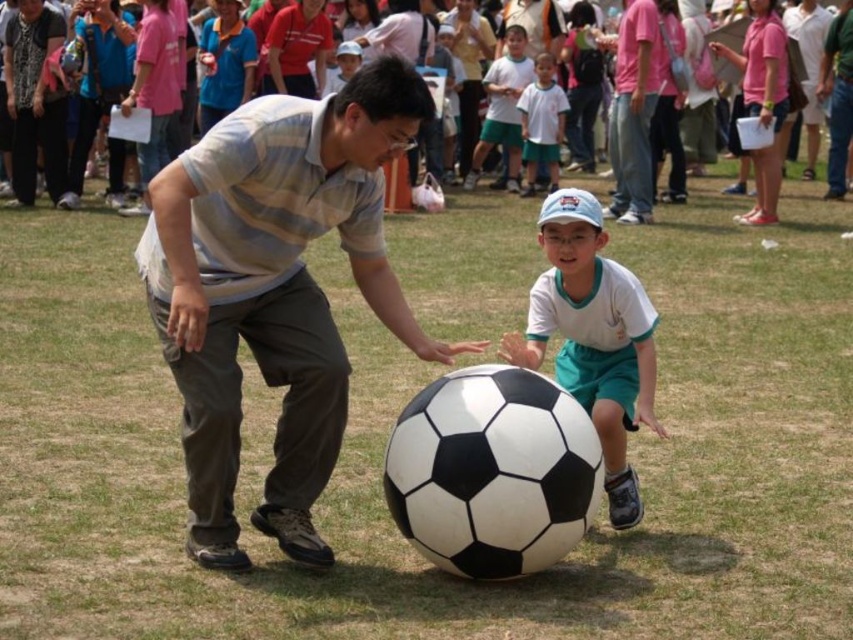
Can you confirm if white cotton shirt at upper center is taller than pink cotton crowd at upper center?

No.

Locate an element on the screen. The height and width of the screenshot is (640, 853). white cotton shirt at upper center is located at coordinates (503, 108).

Who is positioned more to the left, white matte soccer ball at center or pink cotton crowd at upper center?

pink cotton crowd at upper center is more to the left.

Who is higher up, white matte soccer ball at center or pink cotton crowd at upper center?

pink cotton crowd at upper center

The image size is (853, 640). I want to click on white matte soccer ball at center, so click(x=592, y=337).

Which is more to the right, striped cotton shirt at center or white cotton shirt at upper center?

white cotton shirt at upper center is more to the right.

At what (x,y) coordinates should I click in order to perform the action: click on striped cotton shirt at center. Please return your answer as a coordinate pair (x, y). The height and width of the screenshot is (640, 853). Looking at the image, I should click on (276, 291).